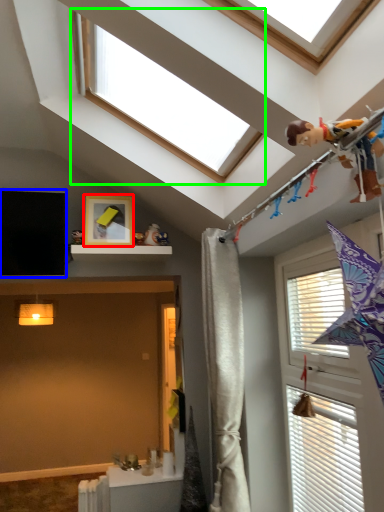
Question: Estimate the real-world distances between objects in this image. Which object is farther from picture frame (highlighted by a red box), window screen (highlighted by a blue box) or window (highlighted by a green box)?

Choices:
 (A) window screen
 (B) window

Answer: (B)